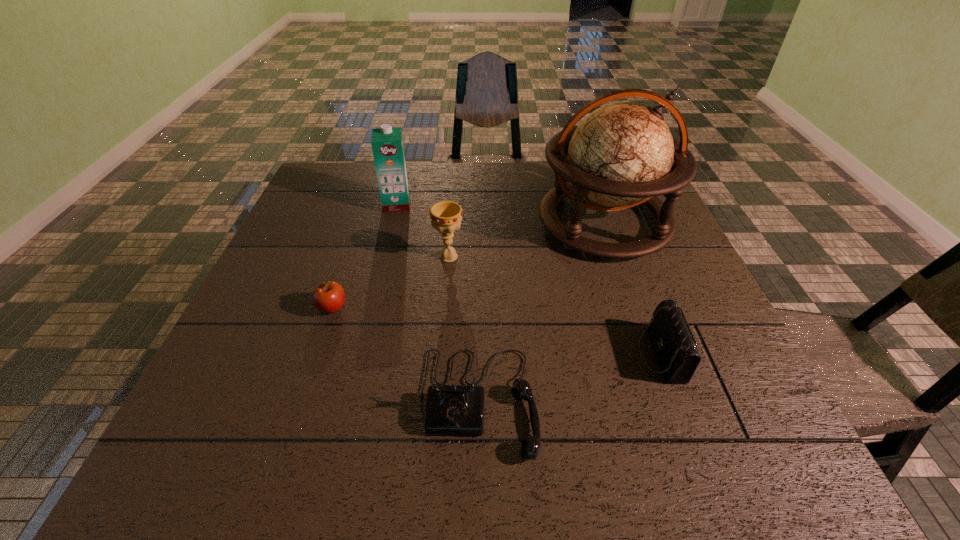
At what (x,y) coordinates should I click in order to perform the action: click on blank area located 0.210m on the front of the chalice. Please return your answer as a coordinate pair (x, y). The width and height of the screenshot is (960, 540). Looking at the image, I should click on coord(443,333).

You are a GUI agent. You are given a task and a screenshot of the screen. Output one action in this format:
    pyautogui.click(x=<x>, y=<y>)
    Task: Click on the vacant space located 0.330m on the front flap of the clutch bag
    
    Given the screenshot: What is the action you would take?
    pyautogui.click(x=478, y=355)

Find the location of a particular element. free spot located on the front flap of the clutch bag is located at coordinates (611, 355).

Locate an element on the screen. Image resolution: width=960 pixels, height=540 pixels. vacant space located on the front flap of the clutch bag is located at coordinates (601, 355).

This screenshot has height=540, width=960. I want to click on free space located on the front of the apple, so click(x=312, y=369).

At what (x,y) coordinates should I click in order to perform the action: click on globe at the far edge. Please return your answer as a coordinate pair (x, y). The height and width of the screenshot is (540, 960). Looking at the image, I should click on (620, 156).

Locate an element on the screen. The width and height of the screenshot is (960, 540). carton located in the far edge section of the desktop is located at coordinates (387, 144).

At what (x,y) coordinates should I click in order to perform the action: click on object positioned at the near edge. Please return your answer as a coordinate pair (x, y). Image resolution: width=960 pixels, height=540 pixels. Looking at the image, I should click on (458, 410).

Find the location of `object present at the left edge`. object present at the left edge is located at coordinates (328, 297).

What are the coordinates of `globe at the right edge` in the screenshot? It's located at (620, 156).